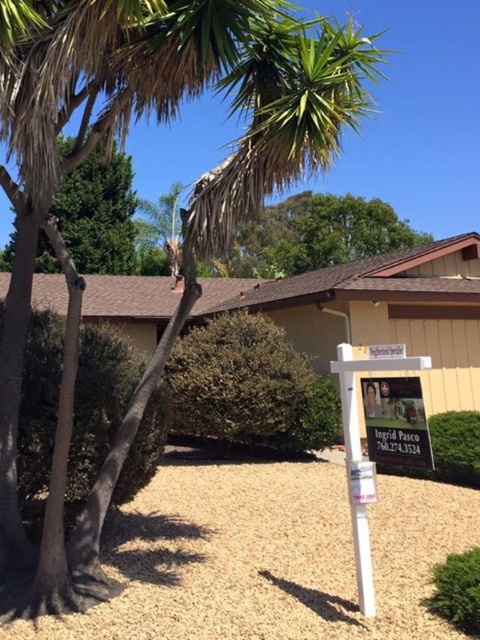
You are a gardener planning to install a new sprinkler system in the yard. The sprinkler requires a clearance of 2 meters to avoid hitting any objects. Given the green leafy tree at upper left and the white plastic sign at lower right, which object might interfere with the sprinkler system?

The white plastic sign at lower right is taller than the green leafy tree at upper left. Since the sprinkler requires 2 meters of clearance, the white plastic sign at lower right may interfere if it exceeds that height, but the tree is shorter and less likely to interfere.

You are standing in front of the house and want to take a photo of the green leafy tree at upper left. If your camera has a maximum zoom range of 20 meters, will you be able to capture the tree clearly without moving closer?

The green leafy tree at upper left is 18.87 meters from camera, which is within the camera maximum zoom range of 20 meters. Therefore, you can capture the tree clearly without moving closer.

You are standing in the residential property and want to take a photo of both point (360, 490) and point (377, 396). Since you want both points to be in focus, which point should you focus on to ensure both are sharp?

You should focus on point (360, 490) because it is closer to the camera. When focusing on the closer object, the depth of field will extend backward, covering both points.